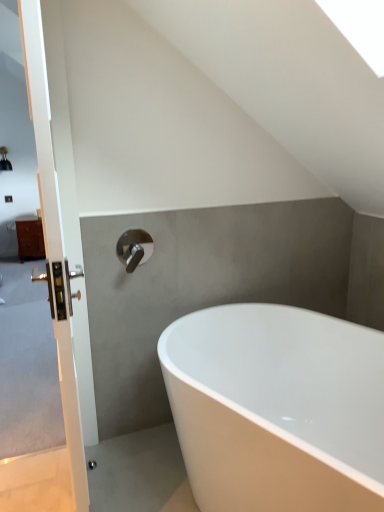
Question: In the image, is satin nickel faucet at upper center positioned in front of or behind white glossy bathtub at center?

Choices:
 (A) front
 (B) behind

Answer: (B)

Question: From the image's perspective, is satin nickel faucet at upper center above or below white glossy bathtub at center?

Choices:
 (A) below
 (B) above

Answer: (B)

Question: Which of these objects is positioned farthest from the white glossy door handle at left?

Choices:
 (A) satin nickel faucet at upper center
 (B) white glossy bathtub at center

Answer: (B)

Question: Estimate the real-world distances between objects in this image. Which object is closer to the white glossy door handle at left?

Choices:
 (A) satin nickel faucet at upper center
 (B) white glossy bathtub at center

Answer: (A)